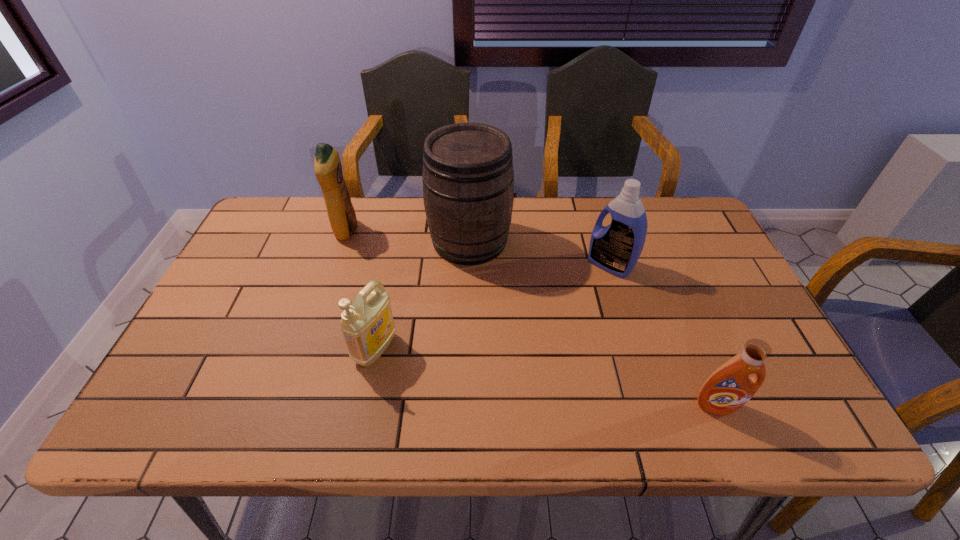
The height and width of the screenshot is (540, 960). I want to click on vacant space at the near left corner of the desktop, so click(180, 435).

I want to click on free location at the near right corner of the desktop, so click(x=777, y=412).

The width and height of the screenshot is (960, 540). In order to click on empty space between the second farthest detergent and the rightmost object in this screenshot , I will do `click(663, 335)`.

Find the location of `free area in between the wine bucket and the third detergent from right to left`. free area in between the wine bucket and the third detergent from right to left is located at coordinates (423, 295).

This screenshot has width=960, height=540. What are the coordinates of `free space between the second object from right to left and the wine bucket` in the screenshot? It's located at (540, 253).

At what (x,y) coordinates should I click in order to perform the action: click on empty location between the second detergent from left to right and the leftmost detergent. Please return your answer as a coordinate pair (x, y). The width and height of the screenshot is (960, 540). Looking at the image, I should click on (361, 290).

You are a GUI agent. You are given a task and a screenshot of the screen. Output one action in this format:
    pyautogui.click(x=<x>, y=<y>)
    Task: Click on the vacant area that lies between the third object from left to right and the third detergent from right to left
    The height and width of the screenshot is (540, 960).
    Given the screenshot: What is the action you would take?
    pyautogui.click(x=423, y=295)

At what (x,y) coordinates should I click in order to perform the action: click on free spot between the fourth object from left to right and the wine bucket. Please return your answer as a coordinate pair (x, y). The image size is (960, 540). Looking at the image, I should click on (540, 253).

Locate an element on the screen. blank region between the third object from right to left and the leftmost detergent is located at coordinates (409, 236).

I want to click on empty space between the fourth object from left to right and the third object from right to left, so click(540, 253).